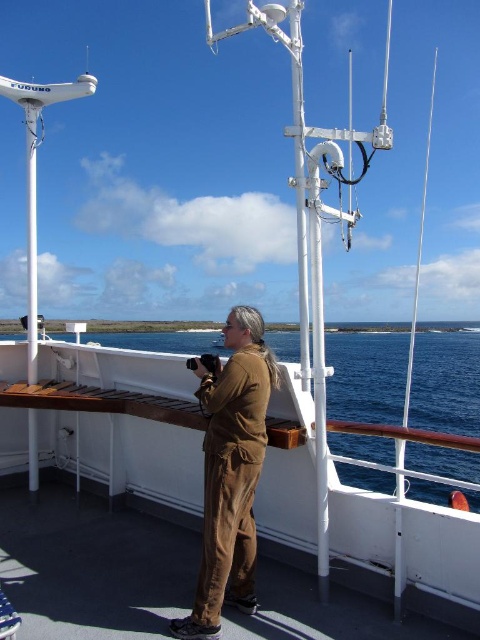
Which is above, blue water at center or brown corduroy pants at center?

brown corduroy pants at center

Which is below, blue water at center or brown corduroy pants at center?

Positioned lower is blue water at center.

Identify the location of blue water at center. Image resolution: width=480 pixels, height=640 pixels. (367, 376).